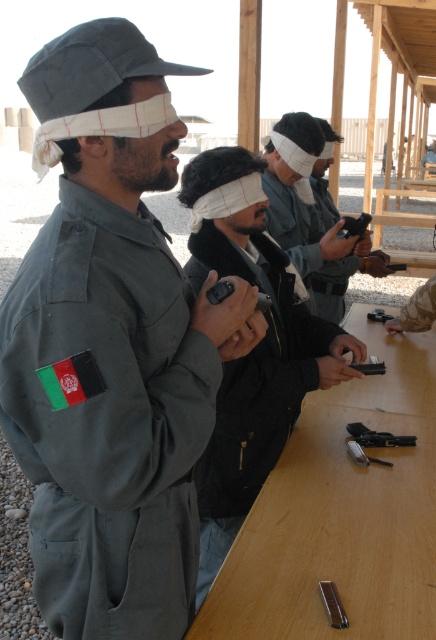
Question: In this image, where is matte gray uniform at center located relative to wooden table at center?

Choices:
 (A) below
 (B) above

Answer: (B)

Question: Which object is farther from the camera taking this photo?

Choices:
 (A) matte black gun at center
 (B) wooden table at center
 (C) matte gray uniform at center
 (D) matte black pistol at center

Answer: (D)

Question: Does matte gray uniform at center appear on the right side of wooden table at center?

Choices:
 (A) no
 (B) yes

Answer: (A)

Question: Is wooden table at center to the right of matte black pistol at center from the viewer's perspective?

Choices:
 (A) yes
 (B) no

Answer: (B)

Question: Which of the following is the closest to the observer?

Choices:
 (A) (323, 285)
 (B) (64, 150)

Answer: (B)

Question: Estimate the real-world distances between objects in this image. Which object is closer to the wooden table at center?

Choices:
 (A) matte black gun at center
 (B) matte black pistol at center
 (C) matte gray uniform at center

Answer: (C)